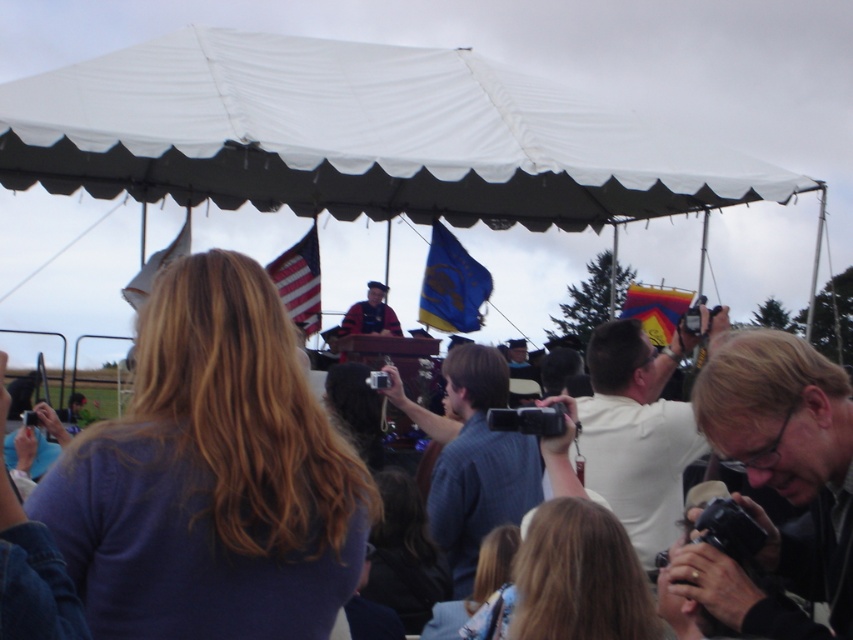
Question: Which point is closer to the camera?

Choices:
 (A) blue plaid shirt at center
 (B) blue fabric crowd at center
 (C) white shirt at center

Answer: (B)

Question: Does white shirt at center appear over white fabric flag at upper left?

Choices:
 (A) no
 (B) yes

Answer: (A)

Question: Is blue fabric crowd at center positioned in front of rainbow fabric kite at upper right?

Choices:
 (A) yes
 (B) no

Answer: (A)

Question: Is white fabric tent at upper center to the right of white fabric flag at upper left from the viewer's perspective?

Choices:
 (A) no
 (B) yes

Answer: (B)

Question: Which of these objects is positioned closest to the blue plaid shirt at center?

Choices:
 (A) black plastic camera at right
 (B) blue fabric crowd at center
 (C) white fabric tent at upper center
 (D) white fabric flag at upper left

Answer: (A)

Question: Which object appears farthest from the camera in this image?

Choices:
 (A) rainbow fabric kite at upper right
 (B) blue fabric crowd at center
 (C) blue plaid shirt at center
 (D) white fabric flag at upper left

Answer: (A)